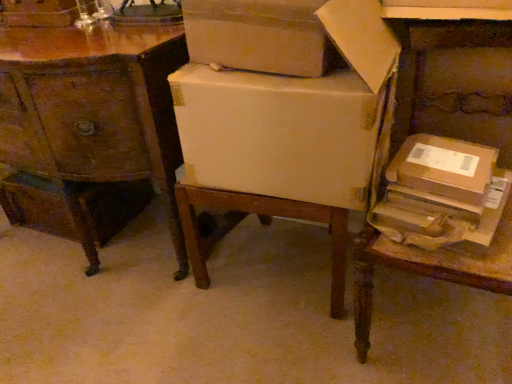
Question: Is brown wooden table at right closer to camera compared to wooden desk at center?

Choices:
 (A) no
 (B) yes

Answer: (B)

Question: From the image's perspective, is brown wooden table at right on top of wooden desk at center?

Choices:
 (A) yes
 (B) no

Answer: (B)

Question: From a real-world perspective, is brown wooden table at right physically below wooden desk at center?

Choices:
 (A) no
 (B) yes

Answer: (B)

Question: From a real-world perspective, is brown wooden table at right positioned over wooden desk at center based on gravity?

Choices:
 (A) no
 (B) yes

Answer: (A)

Question: Are brown wooden table at right and wooden desk at center located far from each other?

Choices:
 (A) no
 (B) yes

Answer: (A)

Question: From a real-world perspective, is matte cardboard box at center, the first cardboard box from the left, physically located above or below brown cardboard box at right, which appears as the first cardboard box when viewed from the right?

Choices:
 (A) above
 (B) below

Answer: (A)

Question: Is matte cardboard box at center, the first cardboard box from the left, situated inside brown cardboard box at right, which appears as the first cardboard box when viewed from the right, or outside?

Choices:
 (A) outside
 (B) inside

Answer: (A)

Question: Is matte cardboard box at center, the first cardboard box from the left, to the left or to the right of brown cardboard box at right, which appears as the first cardboard box when viewed from the right, in the image?

Choices:
 (A) left
 (B) right

Answer: (A)

Question: From the image's perspective, relative to brown cardboard box at right, which appears as the first cardboard box when viewed from the right, is matte cardboard box at center, the first cardboard box from the left, above or below?

Choices:
 (A) above
 (B) below

Answer: (A)

Question: Considering their positions, is matte cardboard box at center, placed as the 2th cardboard box when sorted from right to left, located in front of or behind brown wooden table at right?

Choices:
 (A) behind
 (B) front

Answer: (A)

Question: From the image's perspective, is matte cardboard box at center, placed as the 2th cardboard box when sorted from right to left, located above or below brown wooden table at right?

Choices:
 (A) above
 (B) below

Answer: (A)

Question: Is matte cardboard box at center, placed as the 2th cardboard box when sorted from right to left, to the left or to the right of brown wooden table at right in the image?

Choices:
 (A) right
 (B) left

Answer: (B)

Question: Is matte cardboard box at center, placed as the 2th cardboard box when sorted from right to left, inside the boundaries of brown wooden table at right, or outside?

Choices:
 (A) inside
 (B) outside

Answer: (B)

Question: Considering the relative positions of wooden desk at center and white cardboard box at upper center in the image provided, is wooden desk at center to the left or to the right of white cardboard box at upper center?

Choices:
 (A) left
 (B) right

Answer: (A)

Question: Based on their sizes in the image, would you say wooden desk at center is bigger or smaller than white cardboard box at upper center?

Choices:
 (A) big
 (B) small

Answer: (A)